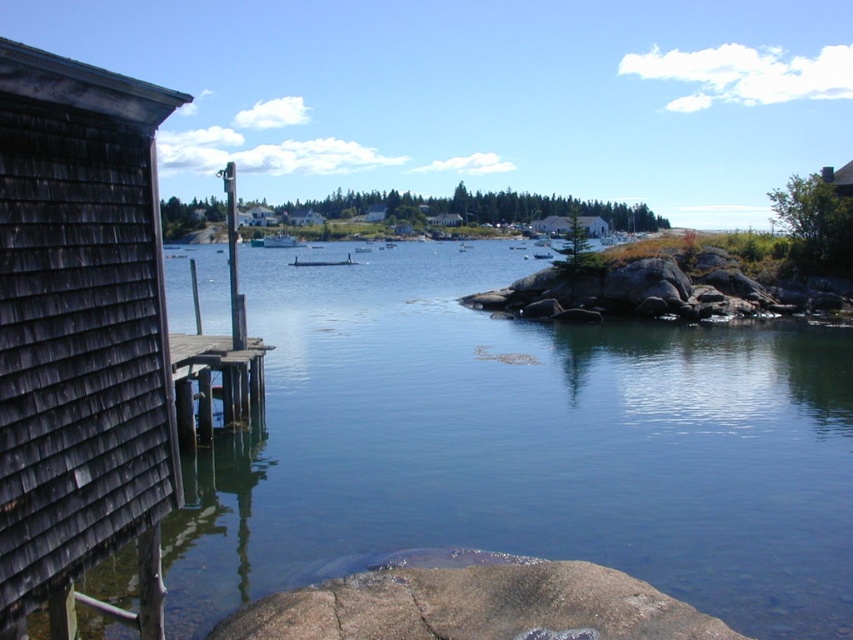
Measure the distance between smooth water at center and gray rough rock at lower center.

smooth water at center is 10.14 meters away from gray rough rock at lower center.

Between smooth water at center and gray rough rock at lower center, which one has less height?

gray rough rock at lower center

Is point (248, 433) positioned behind point (235, 637)?

Yes.

In order to click on smooth water at center in this screenshot , I will do `click(521, 445)`.

Is point (189, 376) positioned after point (276, 241)?

That is False.

Does wooden planks at left appear under green matte boat at center?

Yes.

Does point (195, 388) come behind point (279, 234)?

That is False.

Locate an element on the screen. This screenshot has width=853, height=640. wooden planks at left is located at coordinates (213, 385).

Which is more to the left, white wood house at center or white shingled house at center?

From the viewer's perspective, white shingled house at center appears more on the left side.

Who is more forward, (x=534, y=221) or (x=247, y=216)?

Point (x=534, y=221)

What are the coordinates of `white wood house at center` in the screenshot? It's located at (552, 225).